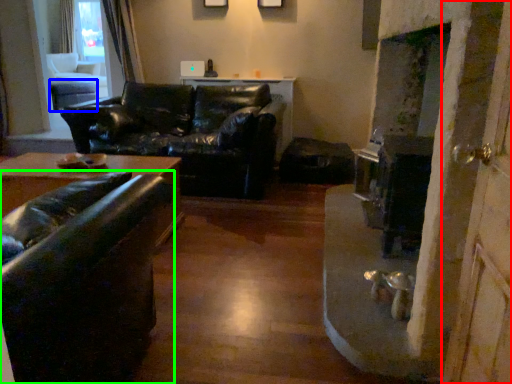
Question: Considering the real-world distances, which object is closest to screen door (highlighted by a red box)? table (highlighted by a blue box) or studio couch (highlighted by a green box).

Choices:
 (A) table
 (B) studio couch

Answer: (B)